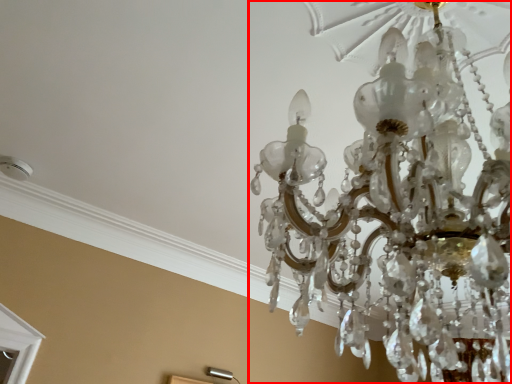
Question: Observing the image, what is the correct spatial positioning of lamp (annotated by the red box) in reference to lamp?

Choices:
 (A) left
 (B) right

Answer: (B)